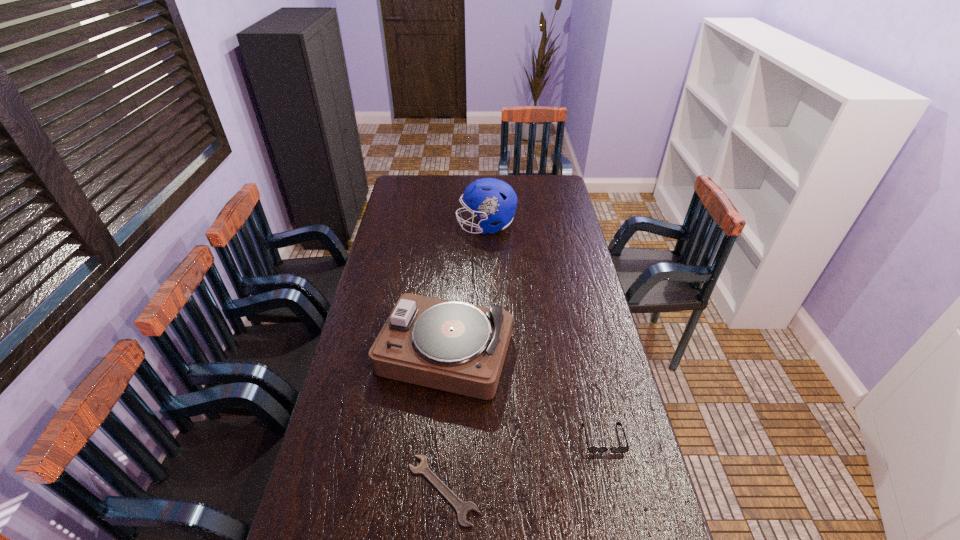
This screenshot has width=960, height=540. Find the location of `the farthest object`. the farthest object is located at coordinates (495, 200).

In order to click on football helmet in this screenshot , I will do `click(495, 200)`.

Where is `the third nearest object`? the third nearest object is located at coordinates (452, 346).

Locate an element on the screen. the third shortest object is located at coordinates (452, 346).

This screenshot has height=540, width=960. In order to click on sunglasses in this screenshot , I will do `click(591, 449)`.

Locate an element on the screen. The height and width of the screenshot is (540, 960). the rightmost object is located at coordinates (591, 449).

Locate an element on the screen. This screenshot has width=960, height=540. the shortest object is located at coordinates (462, 508).

The image size is (960, 540). What are the coordinates of `the nearest object` in the screenshot? It's located at (462, 508).

The width and height of the screenshot is (960, 540). I want to click on free point located 0.090m on the face guard of the football helmet, so click(437, 226).

Find the location of a particular element. Image resolution: width=960 pixels, height=540 pixels. free space located on the face guard of the football helmet is located at coordinates (445, 226).